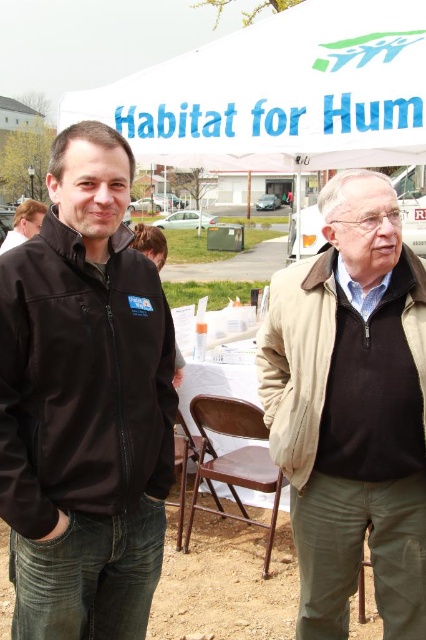
Question: Among these points, which one is nearest to the camera?

Choices:
 (A) (89, 394)
 (B) (354, 120)
 (C) (325, 280)

Answer: (A)

Question: Can you confirm if beige fabric jacket at right is positioned to the right of matte black jacket at center?

Choices:
 (A) yes
 (B) no

Answer: (A)

Question: Estimate the real-world distances between objects in this image. Which object is closer to the beige fabric jacket at right?

Choices:
 (A) dirt field at lower center
 (B) black softshell jacket at left

Answer: (B)

Question: Can you confirm if beige fabric jacket at right is positioned to the right of matte black jacket at center?

Choices:
 (A) yes
 (B) no

Answer: (A)

Question: Is beige fabric jacket at right below matte black jacket at center?

Choices:
 (A) no
 (B) yes

Answer: (B)

Question: Which is nearer to the white fabric canopy at upper center?

Choices:
 (A) beige fabric jacket at right
 (B) dirt field at lower center

Answer: (A)